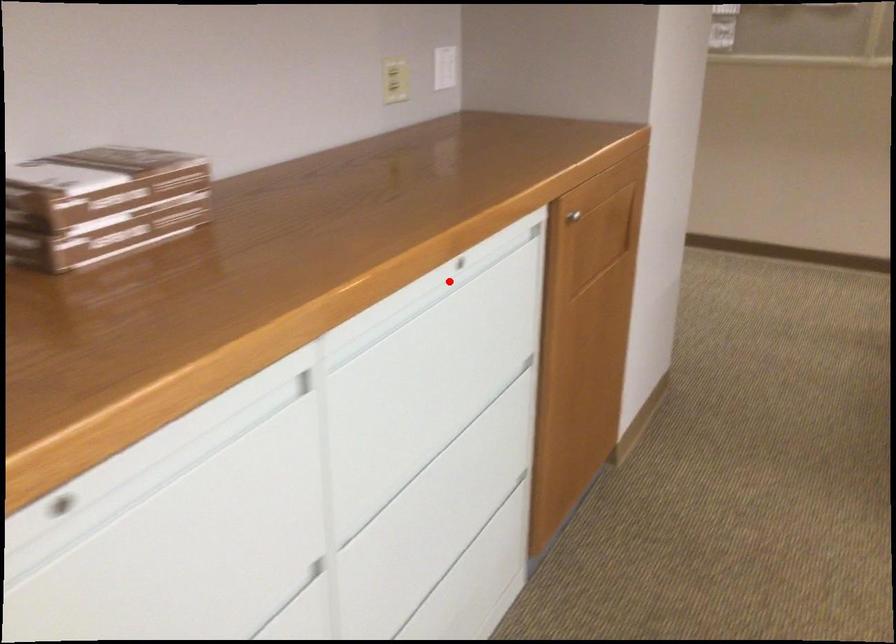
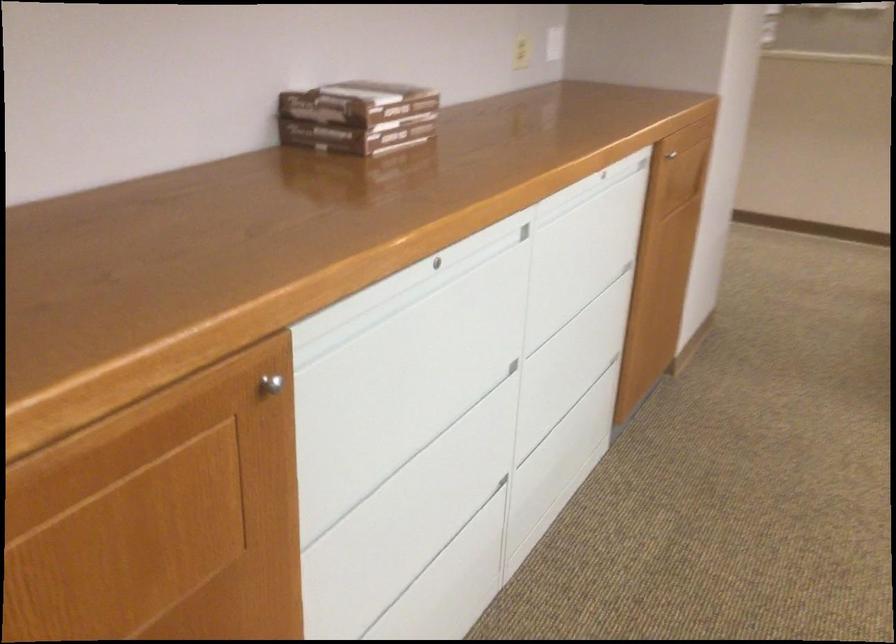
In the second image, find the point that corresponds to the highlighted location in the first image.

(591, 185)